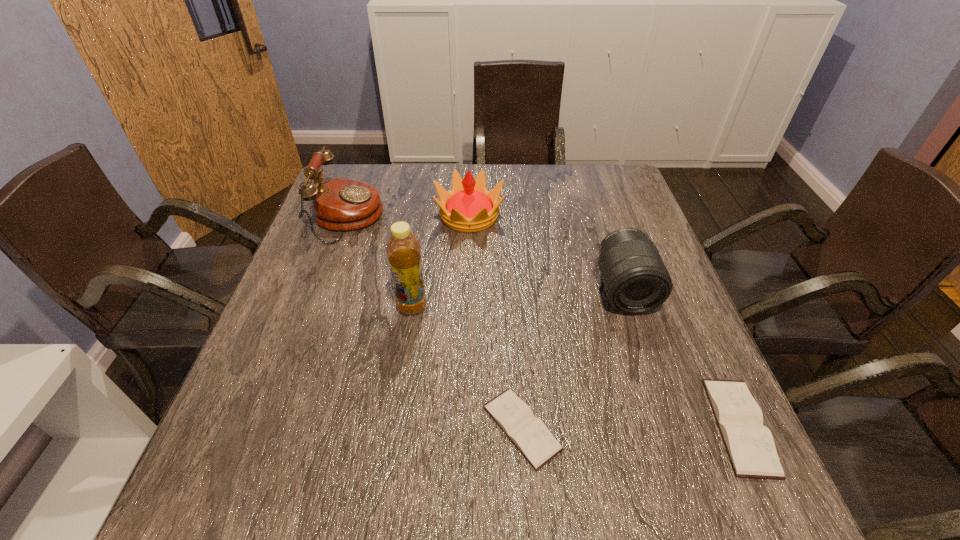
At what (x,y) coordinates should I click in order to perform the action: click on object that is at the near right corner. Please return your answer as a coordinate pair (x, y). Looking at the image, I should click on (750, 445).

Image resolution: width=960 pixels, height=540 pixels. In order to click on vacant position at the far edge of the desktop in this screenshot , I will do `click(560, 165)`.

Locate an element on the screen. This screenshot has height=540, width=960. vacant space at the near edge is located at coordinates (458, 442).

The height and width of the screenshot is (540, 960). I want to click on free space at the left edge of the desktop, so click(293, 326).

Where is `vacant space at the right edge of the desktop`? Image resolution: width=960 pixels, height=540 pixels. vacant space at the right edge of the desktop is located at coordinates [x=647, y=325].

In the image, there is a desktop. Identify the location of vacant space at the far left corner. (349, 178).

Locate an element on the screen. The width and height of the screenshot is (960, 540). free space at the near left corner of the desktop is located at coordinates (228, 440).

In the image, there is a desktop. Identify the location of free space at the far right corner. (613, 170).

What are the coordinates of `free space between the rightmost object and the telephone` in the screenshot? It's located at (543, 322).

You are a GUI agent. You are given a task and a screenshot of the screen. Output one action in this format:
    pyautogui.click(x=<x>, y=<y>)
    Task: Click on the vacant area that lies between the crown and the telephone
    The image size is (960, 540).
    Given the screenshot: What is the action you would take?
    pyautogui.click(x=409, y=217)